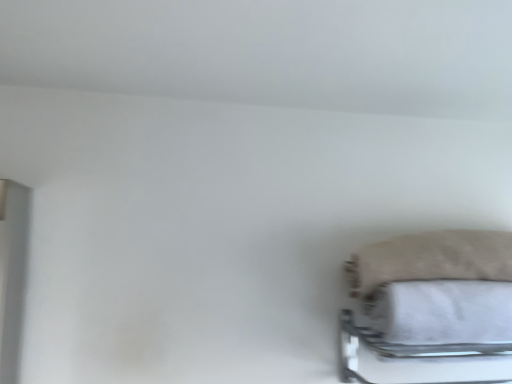
Question: Considering the relative sizes of white fabric bath towel at lower right and beige fuzzy pillow at lower right in the image provided, is white fabric bath towel at lower right thinner than beige fuzzy pillow at lower right?

Choices:
 (A) yes
 (B) no

Answer: (A)

Question: Is beige fuzzy pillow at lower right inside white fabric bath towel at lower right?

Choices:
 (A) no
 (B) yes

Answer: (A)

Question: Is white fabric bath towel at lower right facing away from beige fuzzy pillow at lower right?

Choices:
 (A) yes
 (B) no

Answer: (B)

Question: From a real-world perspective, is white fabric bath towel at lower right under beige fuzzy pillow at lower right?

Choices:
 (A) no
 (B) yes

Answer: (B)

Question: Does white fabric bath towel at lower right have a lesser height compared to beige fuzzy pillow at lower right?

Choices:
 (A) no
 (B) yes

Answer: (A)

Question: Are white fabric bath towel at lower right and beige fuzzy pillow at lower right located far from each other?

Choices:
 (A) no
 (B) yes

Answer: (A)

Question: Does metallic silver bed frame at lower right have a larger size compared to beige fuzzy pillow at lower right?

Choices:
 (A) yes
 (B) no

Answer: (A)

Question: From the image's perspective, is metallic silver bed frame at lower right over beige fuzzy pillow at lower right?

Choices:
 (A) no
 (B) yes

Answer: (A)

Question: Would you say metallic silver bed frame at lower right contains beige fuzzy pillow at lower right?

Choices:
 (A) no
 (B) yes

Answer: (A)

Question: Is metallic silver bed frame at lower right not close to beige fuzzy pillow at lower right?

Choices:
 (A) yes
 (B) no

Answer: (B)

Question: Is the position of metallic silver bed frame at lower right more distant than that of beige fuzzy pillow at lower right?

Choices:
 (A) no
 (B) yes

Answer: (A)

Question: Could you tell me if metallic silver bed frame at lower right is turned towards beige fuzzy pillow at lower right?

Choices:
 (A) yes
 (B) no

Answer: (B)

Question: From a real-world perspective, is beige fuzzy pillow at lower right located higher than metallic silver bed frame at lower right?

Choices:
 (A) yes
 (B) no

Answer: (A)